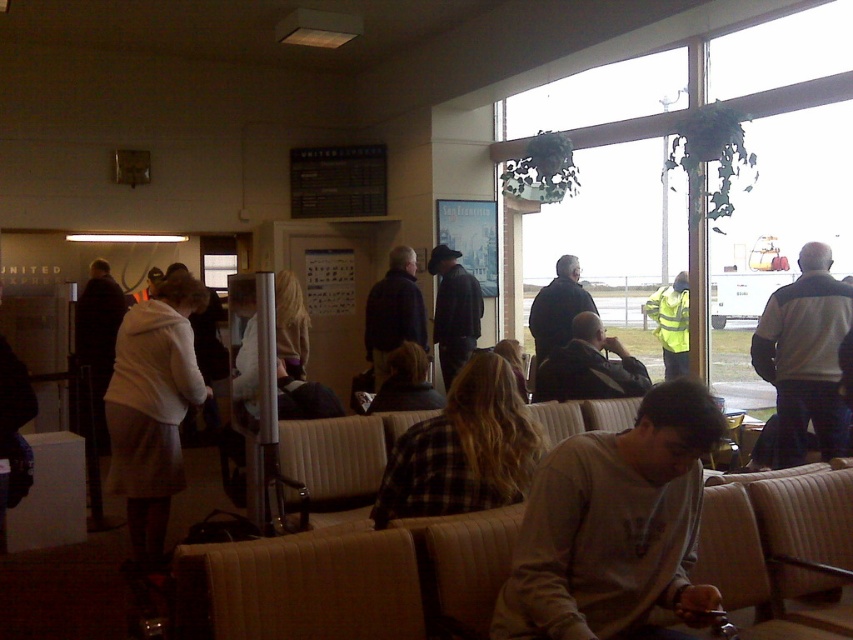
Does gray sweatshirt at center have a greater height compared to dark blue jeans at center?

In fact, gray sweatshirt at center may be shorter than dark blue jeans at center.

Which is more to the left, gray sweatshirt at center or dark blue jeans at center?

Positioned to the left is dark blue jeans at center.

This screenshot has height=640, width=853. In order to click on gray sweatshirt at center in this screenshot , I will do `click(613, 525)`.

Can you confirm if white fabric at left is positioned above dark blue jeans at center?

No.

Can you confirm if white fabric at left is positioned below dark blue jeans at center?

Correct, white fabric at left is located below dark blue jeans at center.

Between point (173, 436) and point (445, 296), which one is positioned behind?

Point (445, 296)

At what (x,y) coordinates should I click in order to perform the action: click on white fabric at left. Please return your answer as a coordinate pair (x, y). Looking at the image, I should click on (152, 408).

Measure the distance between gray sweatshirt at center and high visibility yellow jacket at center.

A distance of 4.42 meters exists between gray sweatshirt at center and high visibility yellow jacket at center.

Between gray sweatshirt at center and high visibility yellow jacket at center, which one has less height?

With less height is gray sweatshirt at center.

Who is more forward, (613, 518) or (685, 284)?

Point (613, 518) is in front.

You are a GUI agent. You are given a task and a screenshot of the screen. Output one action in this format:
    pyautogui.click(x=<x>, y=<y>)
    Task: Click on the gray sweatshirt at center
    This screenshot has width=853, height=640.
    Given the screenshot: What is the action you would take?
    pyautogui.click(x=613, y=525)